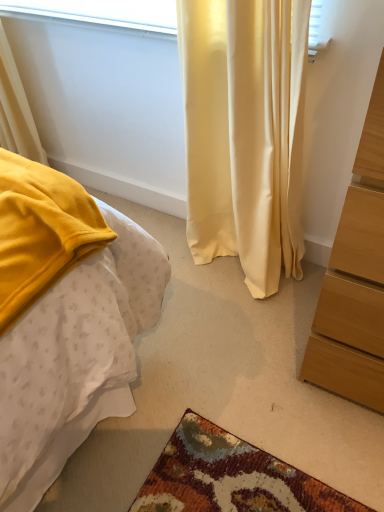
This screenshot has width=384, height=512. In order to click on satin yellow curtain at center in this screenshot , I will do `click(245, 132)`.

Describe the element at coordinates (245, 132) in the screenshot. I see `satin yellow curtain at center` at that location.

Locate an element on the screen. satin yellow curtain at center is located at coordinates (245, 132).